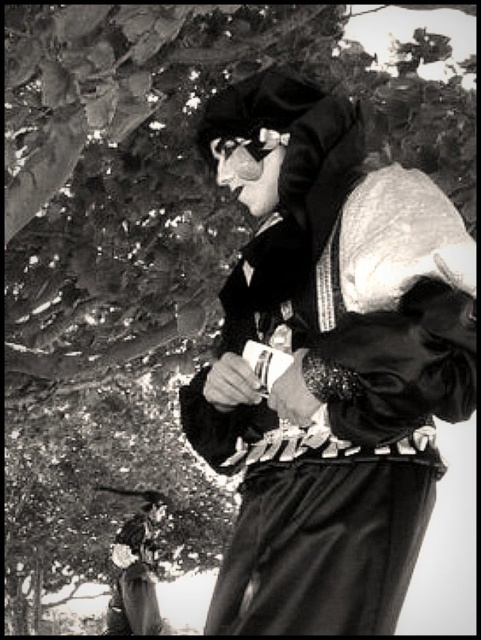
You are an archaeologist examining the image of a person in traditional attire. You notice two items at the center of the image. Which item is positioned lower on the person, the velvet black mask at center or the metallic reflective goggles at center?

The velvet black mask at center is located below metallic reflective goggles at center, so the velvet black mask at center is positioned lower on the person.